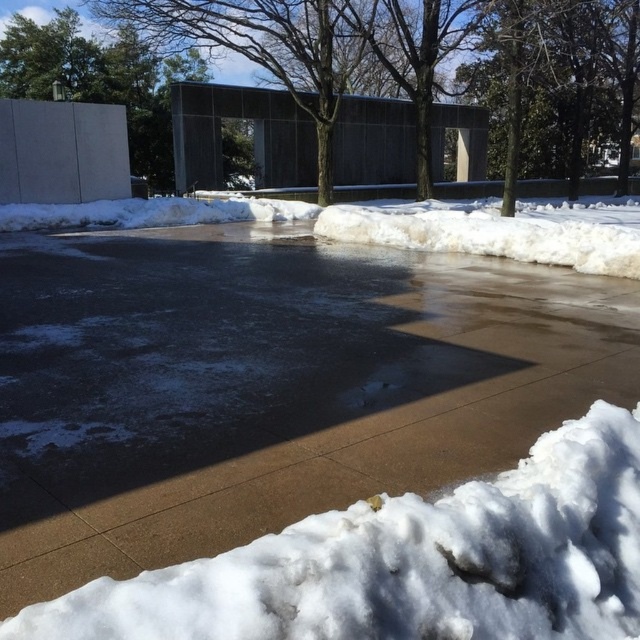
Is brown concrete pavement at center in front of white fluffy snow at center?

Yes.

At what (x,y) coordinates should I click in order to perform the action: click on brown concrete pavement at center. Please return your answer as a coordinate pair (x, y). The height and width of the screenshot is (640, 640). Looking at the image, I should click on (320, 444).

Where is `brown concrete pavement at center`? brown concrete pavement at center is located at coordinates (320, 444).

You are a GUI agent. You are given a task and a screenshot of the screen. Output one action in this format:
    pyautogui.click(x=<x>, y=<y>)
    Task: Click on the brown concrete pavement at center
    The height and width of the screenshot is (640, 640).
    Given the screenshot: What is the action you would take?
    pyautogui.click(x=320, y=444)